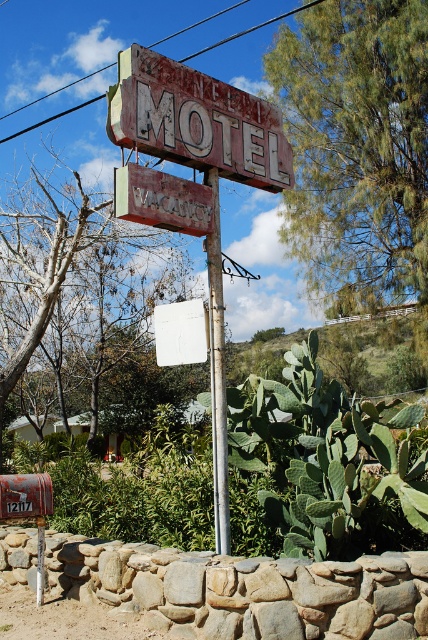
You are a traveler who just arrived at this location and wants to check if the motel has vacancy. You see the rusty metal motel sign at upper center and the wooden signboard at center. Which sign should you look at to find vacancy information?

The wooden signboard at center is the one to look at for vacancy information because the rusty metal motel sign at upper center is positioned on its right side, meaning the vacancy details are likely displayed on the wooden signboard at center.

You are a traveler approaching the motel and need to read both the rusty metal motel sign at upper center and the wooden signboard at center. Which sign should you look up to see?

The rusty metal motel sign at upper center is located above the wooden signboard at center, so you should look up to see the rusty metal motel sign at upper center.

You are standing in front of the motel sign and want to take a photo. You notice two points marked in the scene. Which point, point (133, 99) or point (217, 444), would appear larger in your camera view?

Point (133, 99) would appear larger in the camera view because it is closer to the camera than point (217, 444).